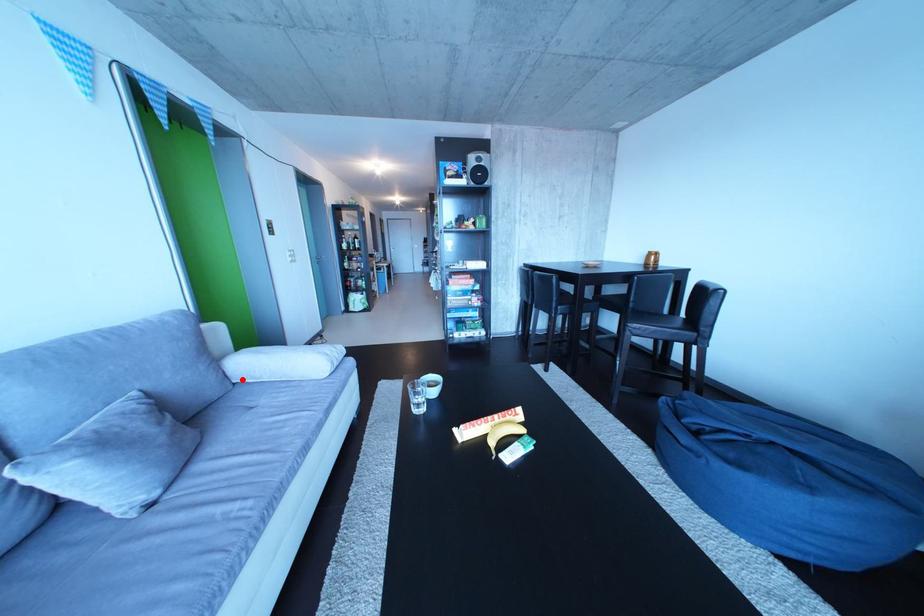
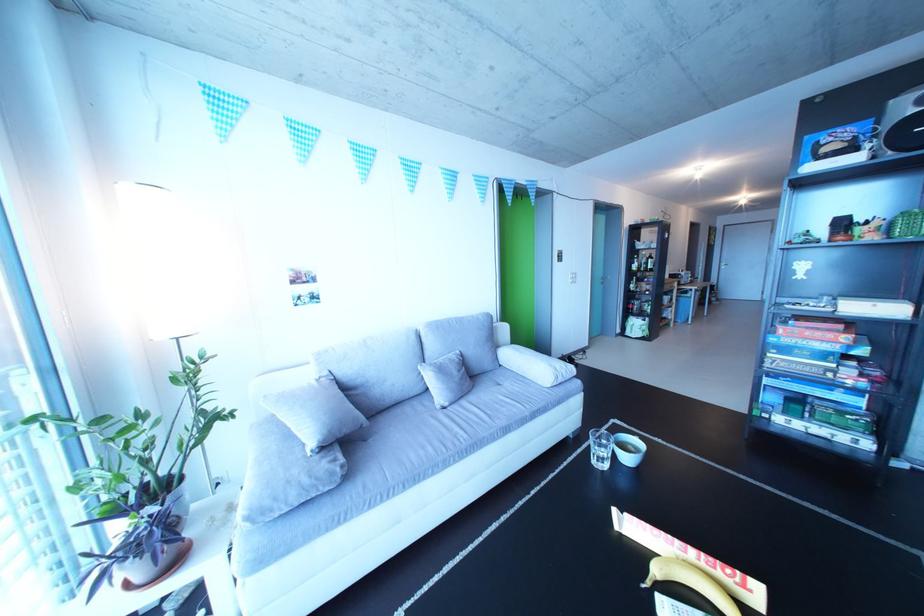
Question: I am providing you with two images of the same scene from different viewpoints. Image1 has a red point marked. In image2, the corresponding 3D location appears at what relative position? Reply with the corresponding letter.

Choices:
 (A) Closer
 (B) Farther

Answer: (B)